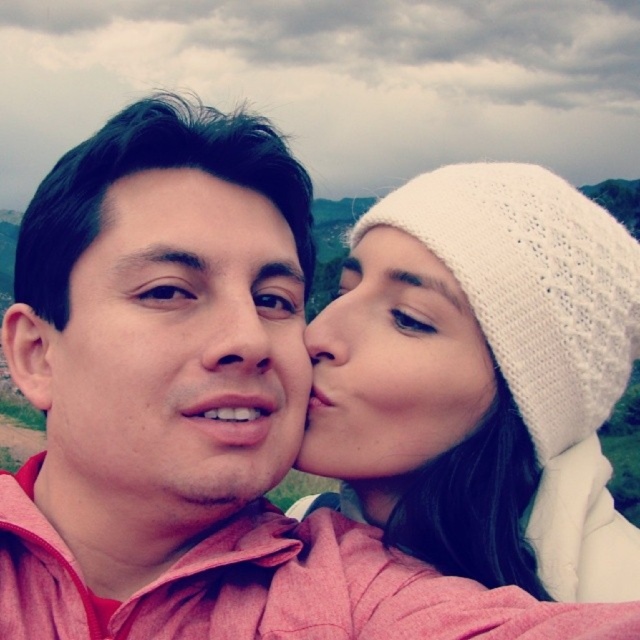
You are a photographer trying to capture a close detail shot of the two people in the image. You want to focus on the white knitted beanie at upper right and the smooth skin nose at center. Which object should you zoom in more on to ensure it fills the frame adequately?

The white knitted beanie at upper right is larger in size than the smooth skin nose at center, so you should zoom in more on the smooth skin nose at center to ensure it fills the frame adequately.

Based on the scene description, where is the white knitted beanie at upper right located in the image?

The white knitted beanie at upper right is located at the 2D coordinates point (x=484, y=380) in the image.

You are a photographer standing 10 feet away from the white knitted beanie at upper right and smooth skin nose at center. Can you fit both objects into your camera frame if your camera has a maximum viewing angle of 60 degrees?

The distance between the white knitted beanie at upper right and smooth skin nose at center is 8.46 feet. Since you are 10 feet away from both objects, the angle between them can be calculated using trigonometry. The angle would be approximately 2 arcsin inverse of 8.46 divided by 2 times 10. This results in an angle of roughly 49 degrees, which is within the camera frame of 60 degrees. Therefore, both objects can be captured in the frame.